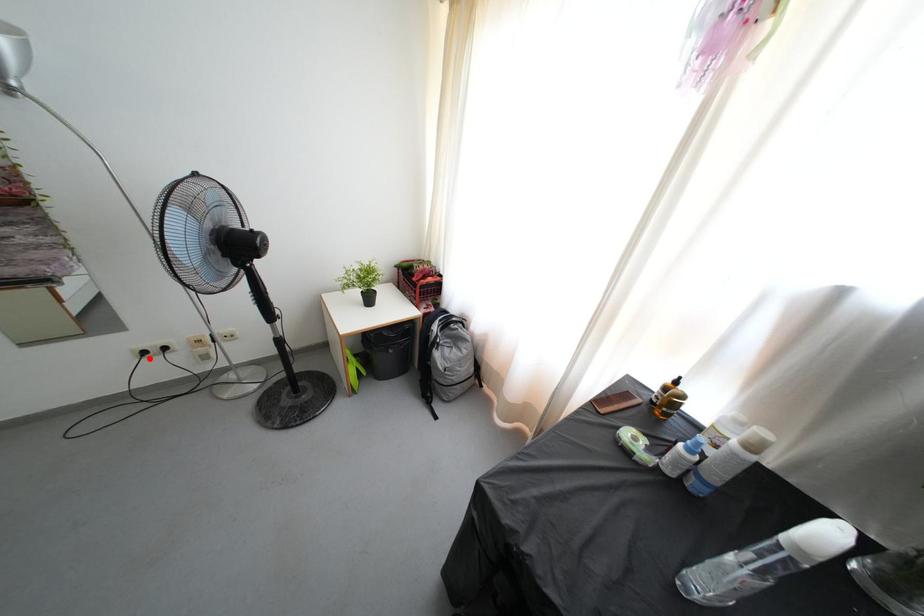
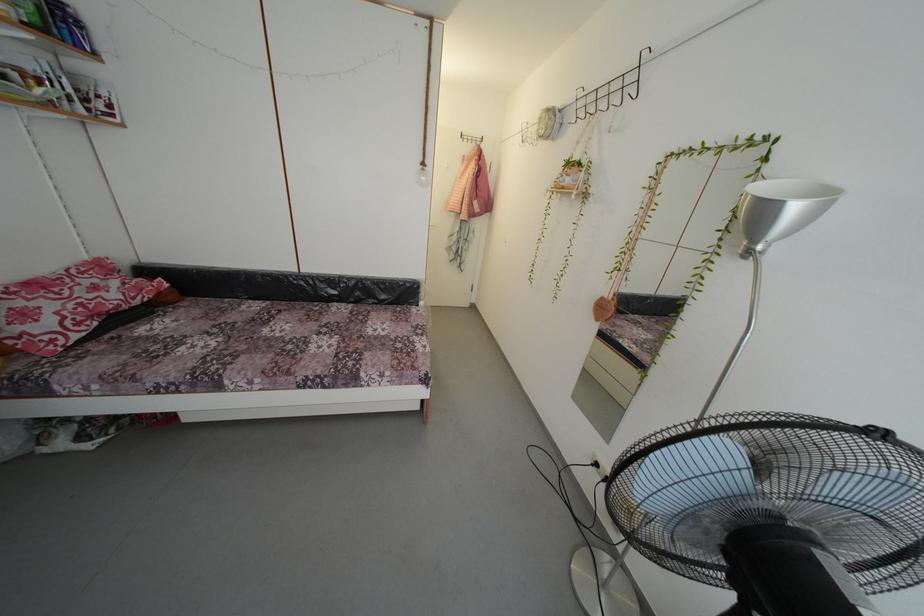
In the second image, find the point that corresponds to the highlighted location in the first image.

(602, 469)